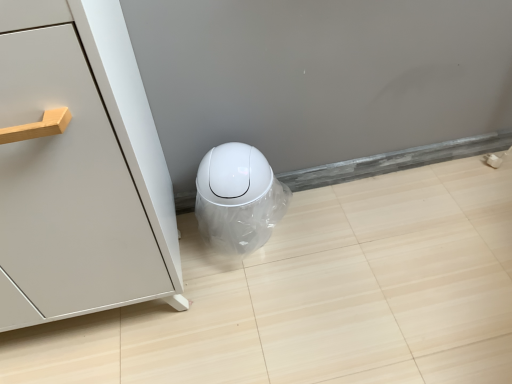
Where is `spots to the right of matte white cabinet at left`? spots to the right of matte white cabinet at left is located at coordinates (245, 315).